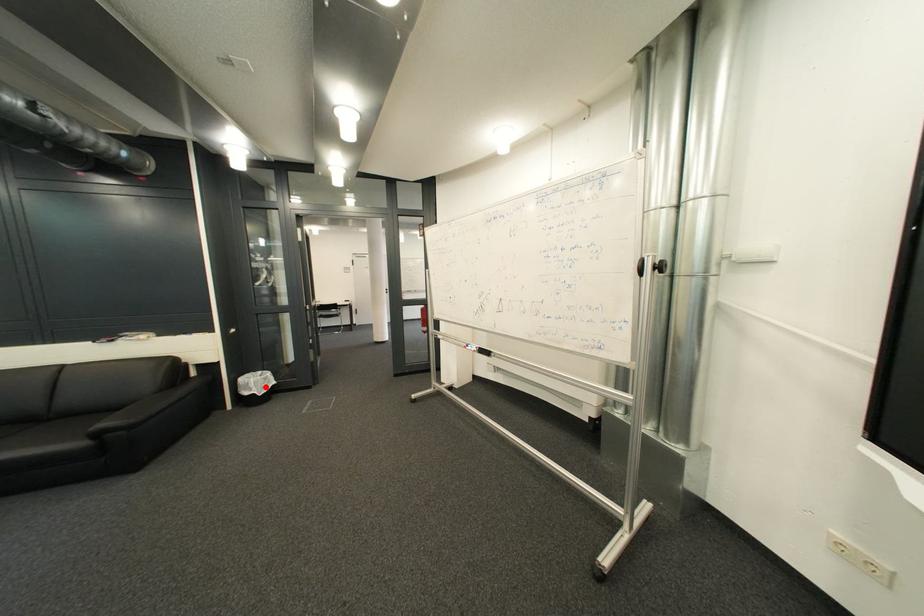
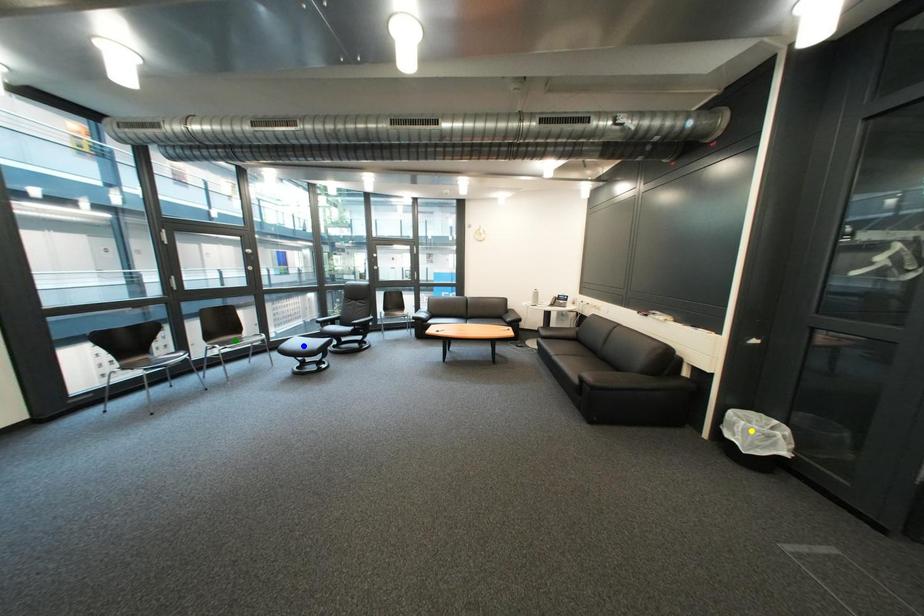
Question: I am providing you with two images of the same scene from different viewpoints. A red point is marked on the first image. You are given multiple points on the second image. In image 2, which mark is for the same physical point as the one in image 1?

Choices:
 (A) yellow point
 (B) green point
 (C) blue point

Answer: (A)